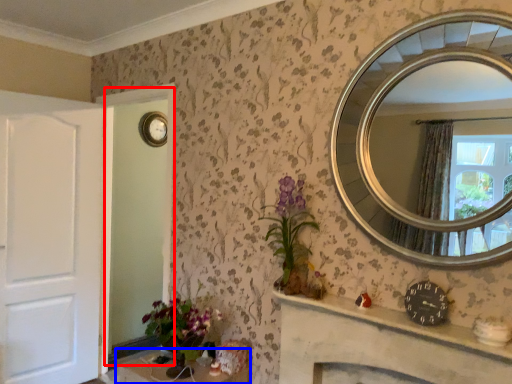
Question: Among these objects, which one is farthest to the camera, glass door (highlighted by a red box) or table (highlighted by a blue box)?

Choices:
 (A) glass door
 (B) table

Answer: (A)